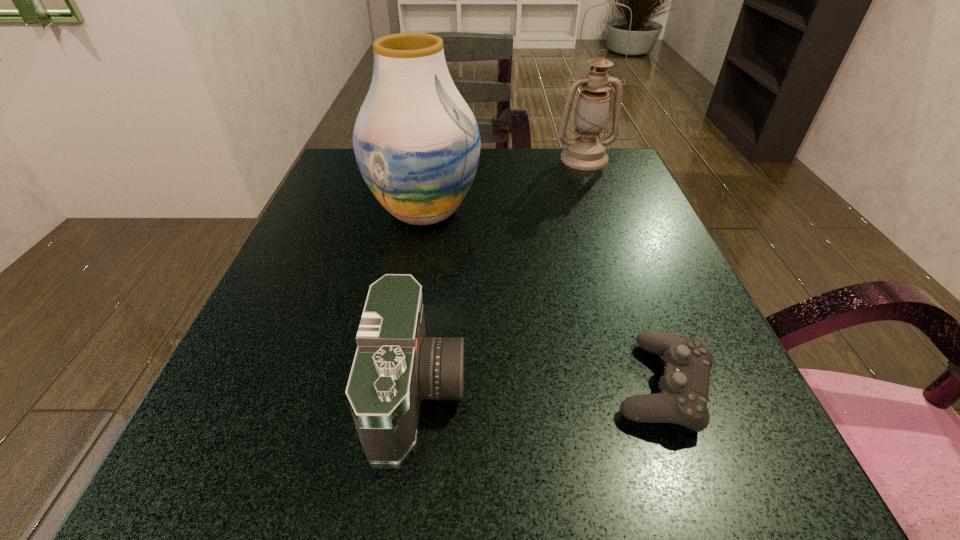
Find the location of a particular element. oil lamp is located at coordinates (585, 152).

Identify the location of vase. (417, 144).

Locate an element on the screen. This screenshot has height=540, width=960. camera is located at coordinates (395, 366).

The image size is (960, 540). In order to click on the shortest object in this screenshot , I will do `click(684, 386)`.

What are the coordinates of `free space located on the front of the farthest object` in the screenshot? It's located at (612, 233).

At what (x,y) coordinates should I click in order to perform the action: click on vacant space located on the right of the vase. Please return your answer as a coordinate pair (x, y). This screenshot has height=540, width=960. Looking at the image, I should click on (528, 211).

Locate an element on the screen. The image size is (960, 540). free space located 0.160m on the front-facing side of the camera is located at coordinates (583, 390).

Identify the location of vacant space positioned on the front of the control. (702, 497).

Locate an element on the screen. The height and width of the screenshot is (540, 960). oil lamp at the far edge is located at coordinates (585, 152).

The width and height of the screenshot is (960, 540). Find the location of `vase that is positioned at the far edge`. vase that is positioned at the far edge is located at coordinates (417, 144).